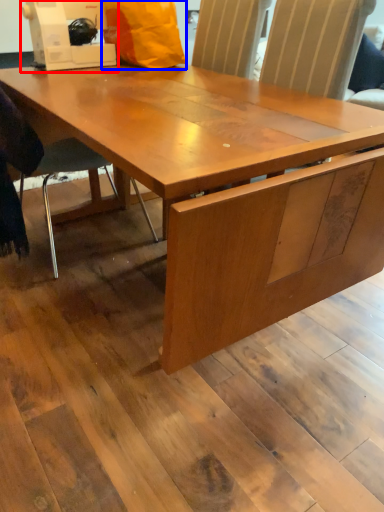
Question: Which object is further to the camera taking this photo, sewing machine (highlighted by a red box) or paper bag (highlighted by a blue box)?

Choices:
 (A) sewing machine
 (B) paper bag

Answer: (B)